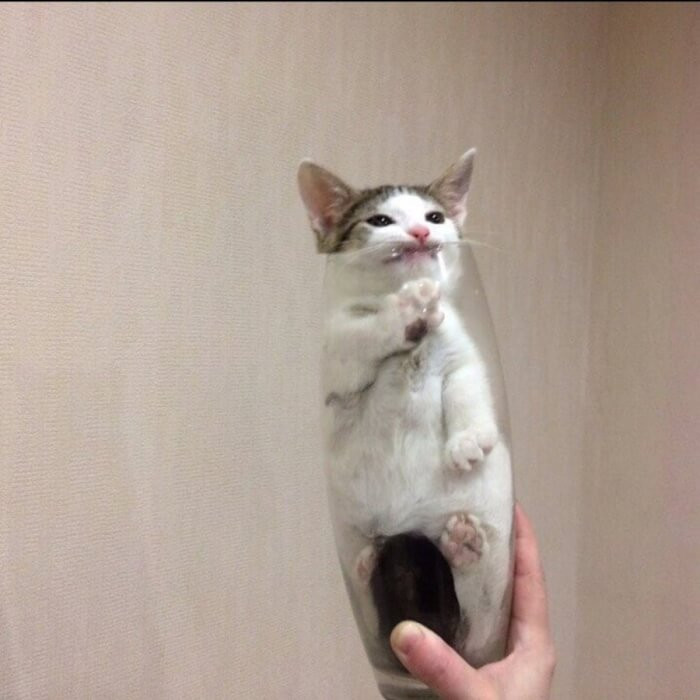
Locate an element on the screen. base of glass is located at coordinates (395, 690).